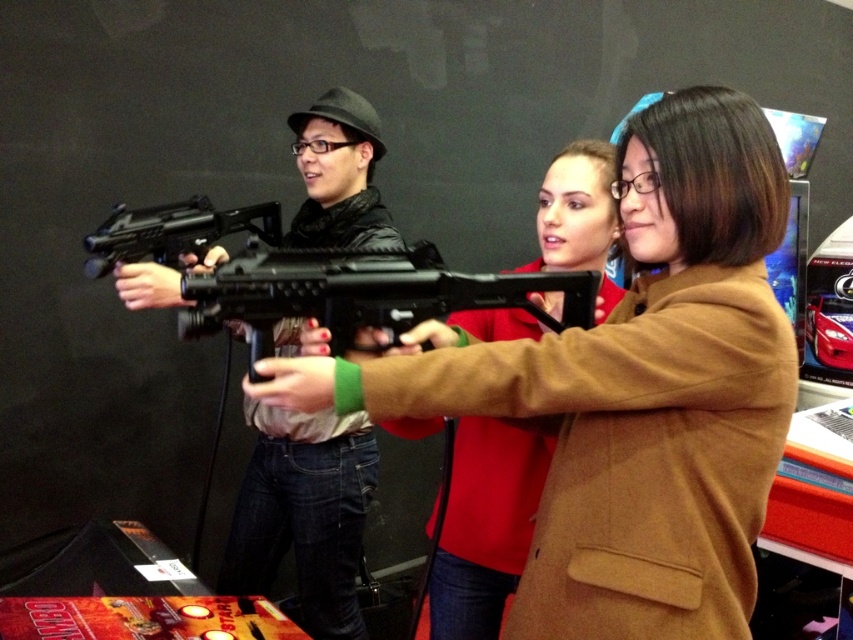
Is matte black gun at center further to the viewer compared to black matte gun at center?

No, matte black gun at center is in front of black matte gun at center.

You are a GUI agent. You are given a task and a screenshot of the screen. Output one action in this format:
    pyautogui.click(x=<x>, y=<y>)
    Task: Click on the matte black gun at center
    The height and width of the screenshot is (640, 853).
    Given the screenshot: What is the action you would take?
    pyautogui.click(x=305, y=513)

Is point (302, 596) positioned behind point (239, 228)?

Yes, it is behind point (239, 228).

The width and height of the screenshot is (853, 640). I want to click on matte black gun at center, so click(x=305, y=513).

Is black plastic rifle at center wider than black matte gun at center?

Yes.

This screenshot has width=853, height=640. I want to click on black plastic rifle at center, so click(363, 294).

Which is in front, point (294, 280) or point (190, 214)?

Point (294, 280)

At what (x,y) coordinates should I click in order to perform the action: click on black plastic rifle at center. Please return your answer as a coordinate pair (x, y). Looking at the image, I should click on click(363, 294).

Can you confirm if brown woolen coat at center is positioned to the left of black matte gun at center?

No, brown woolen coat at center is not to the left of black matte gun at center.

Who is positioned more to the left, brown woolen coat at center or black matte gun at center?

black matte gun at center

What do you see at coordinates (631, 390) in the screenshot?
I see `brown woolen coat at center` at bounding box center [631, 390].

Locate an element on the screen. This screenshot has height=640, width=853. brown woolen coat at center is located at coordinates (631, 390).